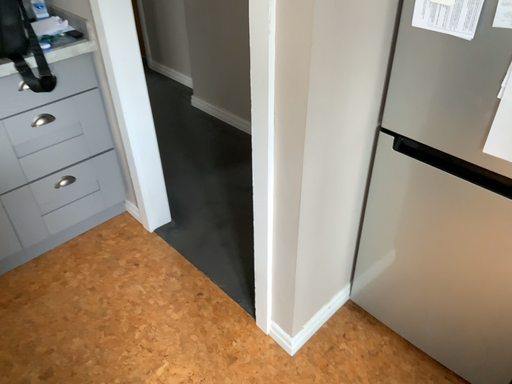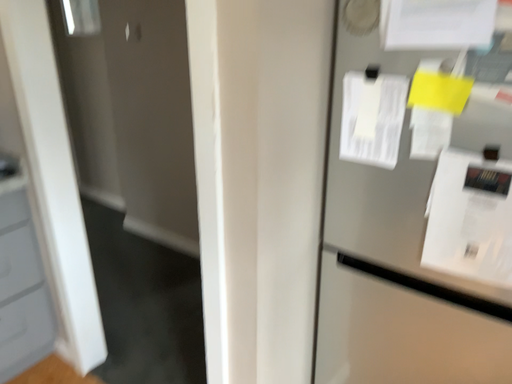
Question: How did the camera likely rotate when shooting the video?

Choices:
 (A) rotated upward
 (B) rotated downward

Answer: (A)